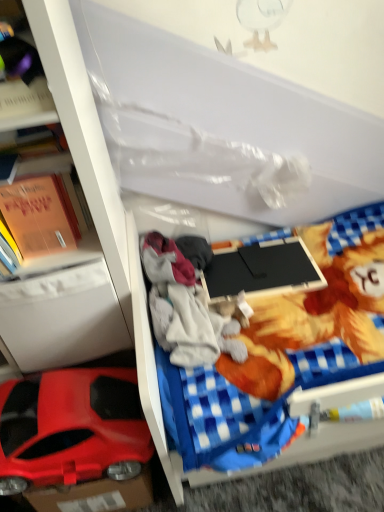
Question: Is white plastic drawer at left positioned far away from black matte laptop at center?

Choices:
 (A) no
 (B) yes

Answer: (A)

Question: From the image's perspective, is white plastic drawer at left located above black matte laptop at center?

Choices:
 (A) no
 (B) yes

Answer: (A)

Question: From a real-world perspective, is white plastic drawer at left located beneath black matte laptop at center?

Choices:
 (A) yes
 (B) no

Answer: (B)

Question: From the image's perspective, is white plastic drawer at left below black matte laptop at center?

Choices:
 (A) yes
 (B) no

Answer: (A)

Question: Does white plastic drawer at left have a greater width compared to black matte laptop at center?

Choices:
 (A) no
 (B) yes

Answer: (B)

Question: Does white plastic drawer at left turn towards black matte laptop at center?

Choices:
 (A) yes
 (B) no

Answer: (B)

Question: Is white plastic bookshelf at left facing towards shiny plastic car at lower left?

Choices:
 (A) yes
 (B) no

Answer: (A)

Question: Can you confirm if white plastic bookshelf at left is smaller than shiny plastic car at lower left?

Choices:
 (A) yes
 (B) no

Answer: (B)

Question: Does white plastic bookshelf at left have a larger size compared to shiny plastic car at lower left?

Choices:
 (A) yes
 (B) no

Answer: (A)

Question: Is white plastic bookshelf at left oriented away from shiny plastic car at lower left?

Choices:
 (A) yes
 (B) no

Answer: (A)

Question: Considering the relative sizes of white plastic bookshelf at left and shiny plastic car at lower left in the image provided, is white plastic bookshelf at left wider than shiny plastic car at lower left?

Choices:
 (A) no
 (B) yes

Answer: (B)

Question: Can you confirm if white plastic bookshelf at left is positioned to the right of shiny plastic car at lower left?

Choices:
 (A) no
 (B) yes

Answer: (A)

Question: Considering the relative sizes of black matte laptop at center and orange paper book at left in the image provided, is black matte laptop at center bigger than orange paper book at left?

Choices:
 (A) yes
 (B) no

Answer: (B)